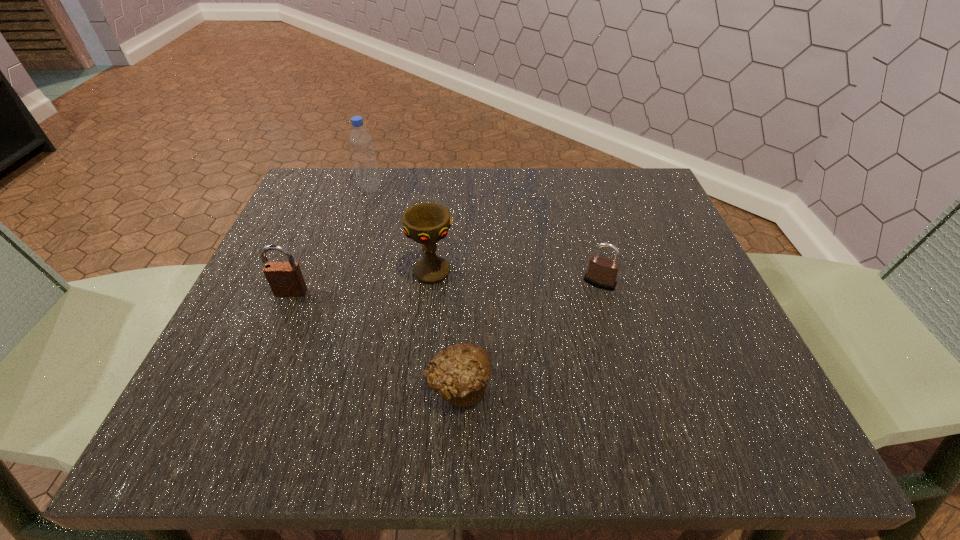
This screenshot has width=960, height=540. I want to click on the tallest object, so coord(361,144).

Identify the location of bottle. (361, 144).

Identify the location of the fourth shortest object. The height and width of the screenshot is (540, 960). (427, 223).

You are a GUI agent. You are given a task and a screenshot of the screen. Output one action in this format:
    pyautogui.click(x=<x>, y=<y>)
    Task: Click on the left padlock
    Image resolution: width=960 pixels, height=540 pixels.
    Given the screenshot: What is the action you would take?
    pyautogui.click(x=285, y=279)

Find the location of a particular element. The width and height of the screenshot is (960, 540). the fourth tallest object is located at coordinates (602, 272).

You are a GUI agent. You are given a task and a screenshot of the screen. Output one action in this format:
    pyautogui.click(x=<x>, y=<y>)
    Task: Click on the rightmost object
    
    Given the screenshot: What is the action you would take?
    (602, 272)

Where is `the nearest object`? The height and width of the screenshot is (540, 960). the nearest object is located at coordinates (459, 374).

At what (x,y) coordinates should I click in order to perform the action: click on muffin. Please return your answer as a coordinate pair (x, y). The height and width of the screenshot is (540, 960). Looking at the image, I should click on (459, 374).

Find the location of a particular element. Image resolution: width=960 pixels, height=540 pixels. vacant space located 0.090m on the front of the tallest object is located at coordinates (361, 218).

You are a GUI agent. You are given a task and a screenshot of the screen. Output one action in this format:
    pyautogui.click(x=<x>, y=<y>)
    Task: Click on the free location located on the front of the second tallest object
    
    Given the screenshot: What is the action you would take?
    pyautogui.click(x=421, y=361)